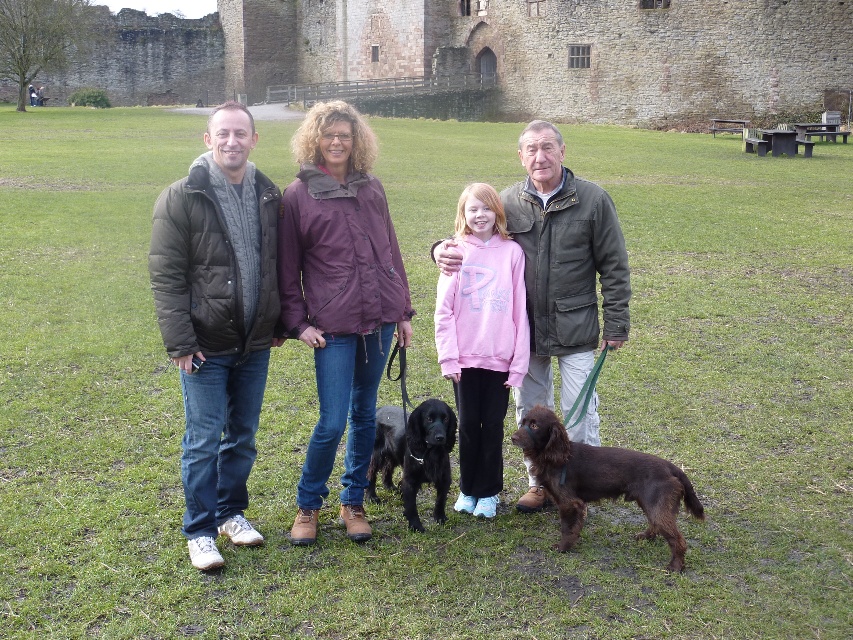
Is point (418, 113) positioned in front of point (548, 436)?

No, (418, 113) is further to viewer.

Describe the element at coordinates (491, 52) in the screenshot. I see `stone wall at upper center` at that location.

What are the coordinates of `stone wall at upper center` in the screenshot? It's located at (491, 52).

Does stone wall at upper center have a lesser width compared to matte black jacket at center?

In fact, stone wall at upper center might be wider than matte black jacket at center.

Measure the distance between stone wall at upper center and matte black jacket at center.

They are 67.59 meters apart.

Who is more distant from viewer, (668, 120) or (338, 436)?

The point (668, 120) is more distant.

The height and width of the screenshot is (640, 853). In order to click on stone wall at upper center in this screenshot , I will do `click(491, 52)`.

You are a GUI agent. You are given a task and a screenshot of the screen. Output one action in this format:
    pyautogui.click(x=<x>, y=<y>)
    Task: Click on the matte black jacket at center
    The image size is (853, 640).
    Given the screenshot: What is the action you would take?
    pyautogui.click(x=331, y=298)

Measure the distance between matte black jacket at center and camera.

24.21 meters

Locate an element on the screen. matte black jacket at center is located at coordinates (331, 298).